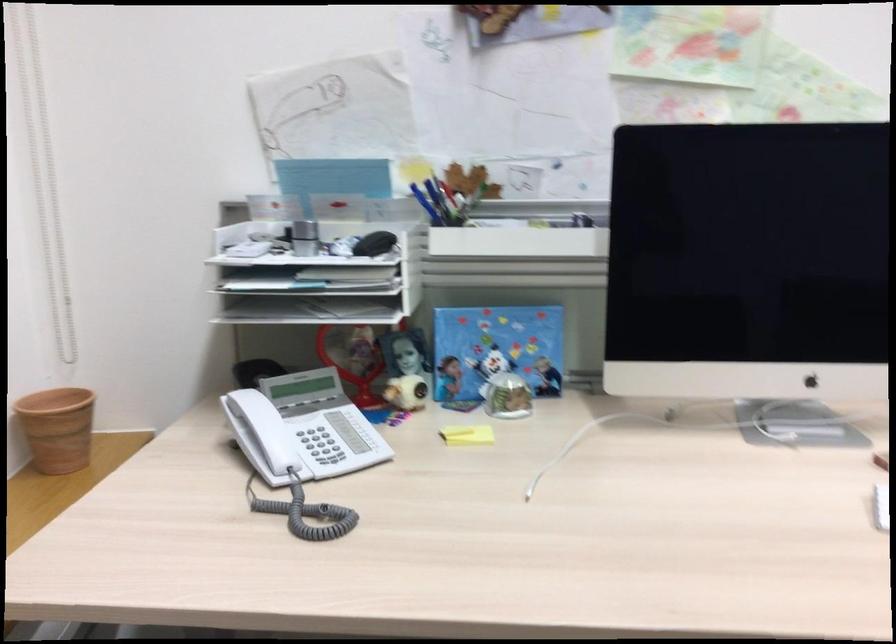
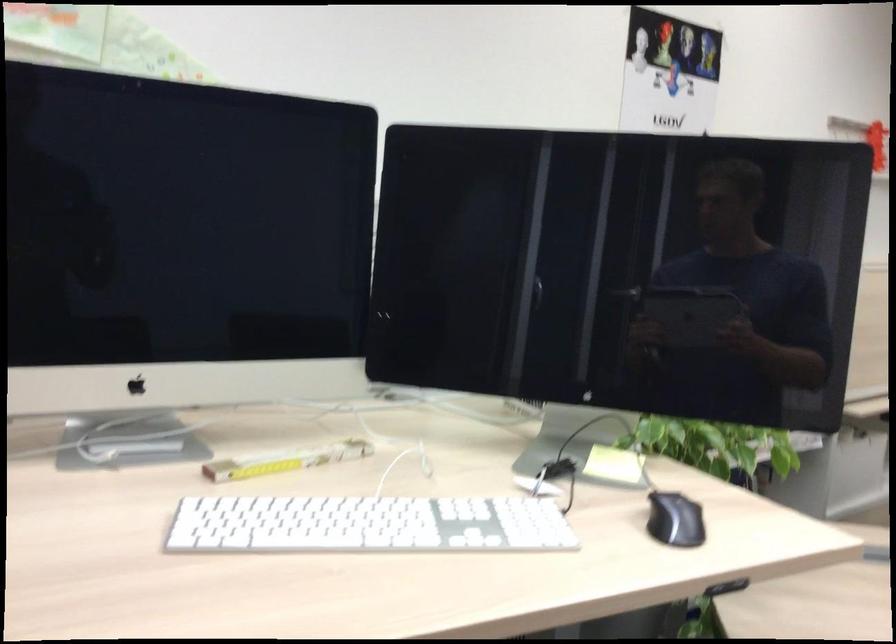
Question: The first image is from the beginning of the video and the second image is from the end. How did the camera likely rotate when shooting the video?

Choices:
 (A) Left
 (B) Right
 (C) Up
 (D) Down

Answer: (B)